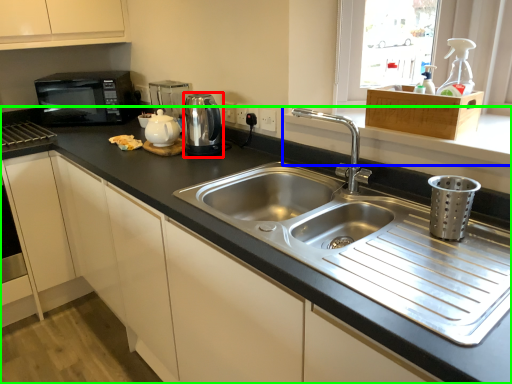
Question: Which is nearer to the appliance (highlighted by a red box)? window sill (highlighted by a blue box) or countertop (highlighted by a green box).

Choices:
 (A) window sill
 (B) countertop

Answer: (B)